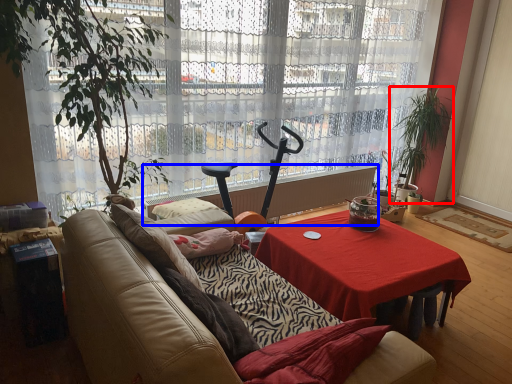
Question: Which point is closer to the camera, houseplant (highlighted by a red box) or radiator (highlighted by a blue box)?

Choices:
 (A) houseplant
 (B) radiator

Answer: (B)